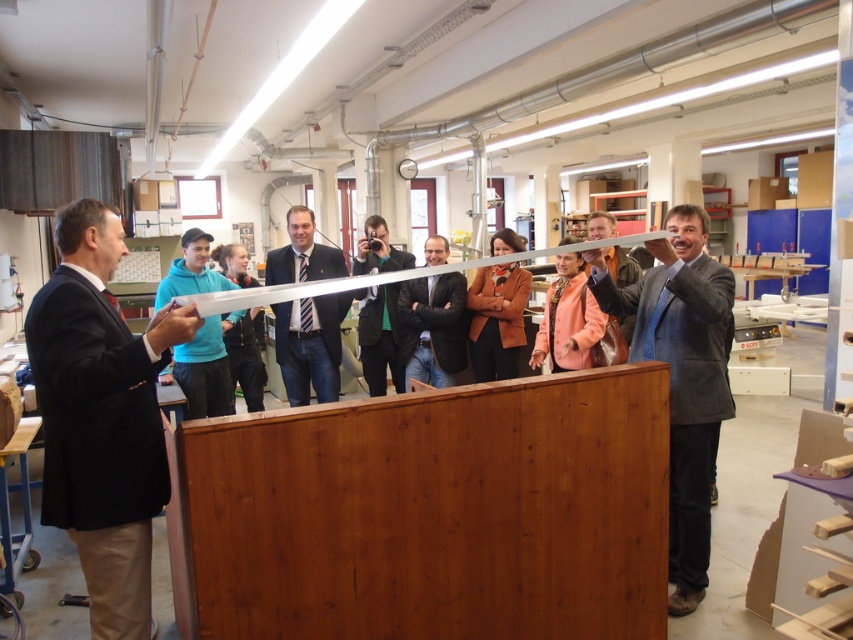
Does point (695, 525) lie behind point (259, 284)?

No, (695, 525) is in front of (259, 284).

Who is lower down, gray suit at right or teal fabric jacket at center?

gray suit at right is below.

Where is `gray suit at right`? The image size is (853, 640). gray suit at right is located at coordinates click(x=682, y=376).

This screenshot has height=640, width=853. Identify the location of gray suit at right. (682, 376).

Which is behind, point (700, 573) or point (187, 376)?

The point (187, 376) is more distant.

Locate an element on the screen. This screenshot has height=640, width=853. gray suit at right is located at coordinates (682, 376).

Based on the photo, does dark brown leather jacket at center appear under green fabric jacket at center?

Yes, dark brown leather jacket at center is below green fabric jacket at center.

Is dark brown leather jacket at center above green fabric jacket at center?

No, dark brown leather jacket at center is not above green fabric jacket at center.

The image size is (853, 640). What do you see at coordinates (433, 326) in the screenshot?
I see `dark brown leather jacket at center` at bounding box center [433, 326].

This screenshot has height=640, width=853. I want to click on dark brown leather jacket at center, so click(x=433, y=326).